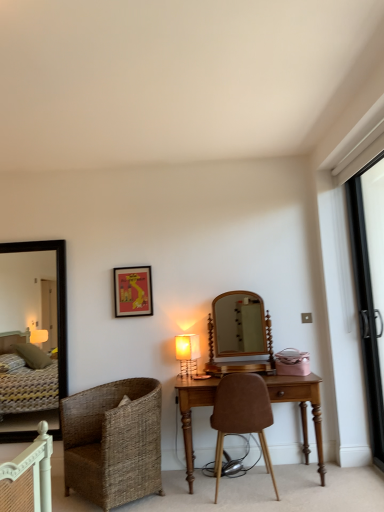
Question: Does brown leather chair at center, arranged as the second chair when viewed from the left, have a greater width compared to metallic gold table lamp at center?

Choices:
 (A) no
 (B) yes

Answer: (B)

Question: Can you confirm if brown leather chair at center, arranged as the second chair when viewed from the left, is smaller than metallic gold table lamp at center?

Choices:
 (A) no
 (B) yes

Answer: (A)

Question: Is brown leather chair at center, arranged as the second chair when viewed from the left, completely or partially outside of metallic gold table lamp at center?

Choices:
 (A) no
 (B) yes

Answer: (B)

Question: Are brown leather chair at center, positioned as the first chair in right-to-left order, and metallic gold table lamp at center beside each other?

Choices:
 (A) no
 (B) yes

Answer: (A)

Question: Is brown leather chair at center, arranged as the second chair when viewed from the left, facing away from metallic gold table lamp at center?

Choices:
 (A) yes
 (B) no

Answer: (B)

Question: From the image's perspective, is woven brown chair at lower left, placed as the 1th chair when sorted from left to right, above or below metallic gold table lamp at center?

Choices:
 (A) below
 (B) above

Answer: (A)

Question: From a real-world perspective, is woven brown chair at lower left, placed as the 1th chair when sorted from left to right, positioned above or below metallic gold table lamp at center?

Choices:
 (A) below
 (B) above

Answer: (A)

Question: Would you say woven brown chair at lower left, which is the second chair in right-to-left order, is to the left or to the right of metallic gold table lamp at center in the picture?

Choices:
 (A) right
 (B) left

Answer: (B)

Question: Does point (105, 432) appear closer or farther from the camera than point (190, 342)?

Choices:
 (A) farther
 (B) closer

Answer: (B)

Question: From the image's perspective, is matte red picture frame at upper center located above or below wooden desk at center?

Choices:
 (A) above
 (B) below

Answer: (A)

Question: In terms of height, does matte red picture frame at upper center look taller or shorter compared to wooden desk at center?

Choices:
 (A) tall
 (B) short

Answer: (B)

Question: Considering the positions of matte red picture frame at upper center and wooden desk at center in the image, is matte red picture frame at upper center wider or thinner than wooden desk at center?

Choices:
 (A) thin
 (B) wide

Answer: (A)

Question: Does point (137, 304) appear closer or farther from the camera than point (266, 375)?

Choices:
 (A) farther
 (B) closer

Answer: (A)

Question: From their relative heights in the image, would you say wooden desk at center is taller or shorter than black wooden mirror at left?

Choices:
 (A) short
 (B) tall

Answer: (A)

Question: Looking at the image, does wooden desk at center seem bigger or smaller compared to black wooden mirror at left?

Choices:
 (A) big
 (B) small

Answer: (A)